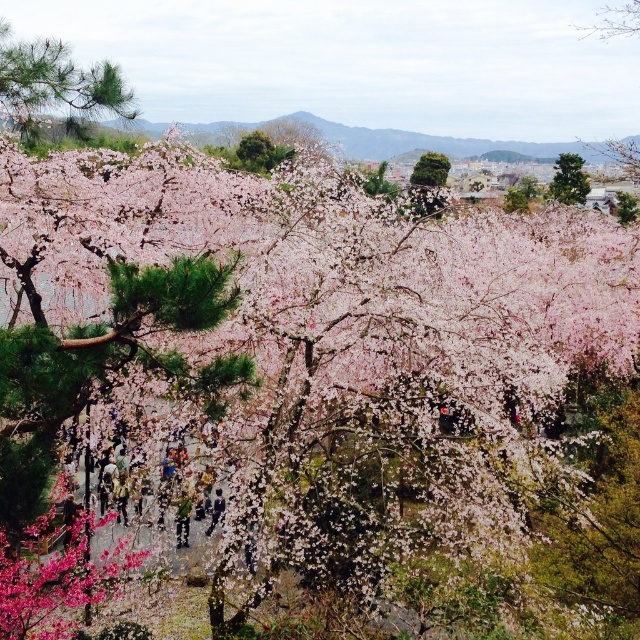
Does green textured pine tree at upper right have a lesser width compared to green leafy tree at center?

No.

Measure the distance between green textured pine tree at upper right and camera.

green textured pine tree at upper right is 67.09 meters away from camera.

The image size is (640, 640). I want to click on green textured pine tree at upper right, so click(x=568, y=179).

Is green matte pine tree at upper left bigger than green fabric person at center?

No.

Between point (54, 44) and point (186, 492), which one is positioned in front?

Point (186, 492) is more forward.

Is point (128, 118) positioned behind point (184, 528)?

Yes, it is.

At what (x,y) coordinates should I click in order to perform the action: click on green matte pine tree at upper left. Please return your answer as a coordinate pair (x, y). Looking at the image, I should click on (56, 86).

Is the position of green matte pine tree at upper left less distant than that of green matte tree at upper center?

That is True.

Between point (29, 42) and point (244, 138), which one is positioned in front?

Point (29, 42) is more forward.

Which is behind, point (102, 97) or point (272, 157)?

The point (272, 157) is more distant.

You are a GUI agent. You are given a task and a screenshot of the screen. Output one action in this format:
    pyautogui.click(x=<x>, y=<y>)
    Task: Click on the green matte pine tree at upper left
    Image resolution: width=640 pixels, height=640 pixels.
    Given the screenshot: What is the action you would take?
    pyautogui.click(x=56, y=86)